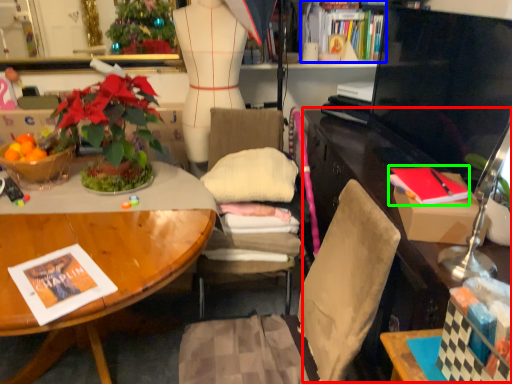
Question: Which object is positioned closest to computer desk (highlighted by a red box)? Select from book (highlighted by a blue box) and magazine (highlighted by a green box).

Choices:
 (A) book
 (B) magazine

Answer: (B)